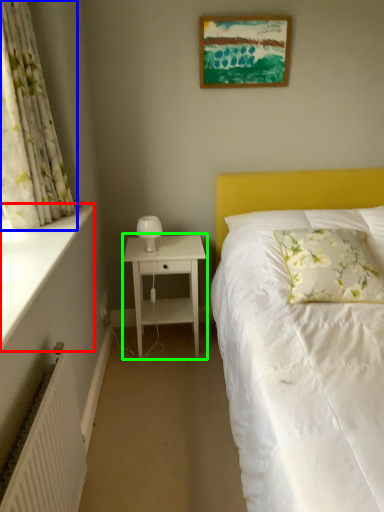
Question: Based on their relative distances, which object is nearer to window sill (highlighted by a red box)? Choose from curtain (highlighted by a blue box) and nightstand (highlighted by a green box).

Choices:
 (A) curtain
 (B) nightstand

Answer: (A)